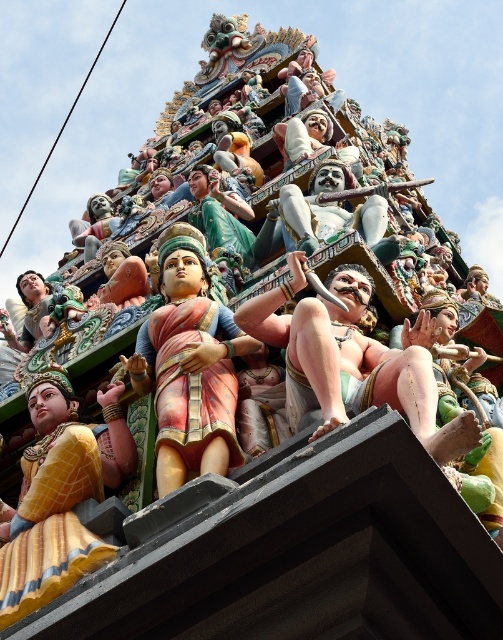
In the scene shown: Is the position of golden-yellow fabric at center less distant than that of polished pink fabric statue at center?

Yes.

Is golden-yellow fabric at center behind polished pink fabric statue at center?

No, golden-yellow fabric at center is closer to the viewer.

At what (x,y) coordinates should I click in order to perform the action: click on golden-yellow fabric at center. Please return your answer as a coordinate pair (x, y). Looking at the image, I should click on (60, 493).